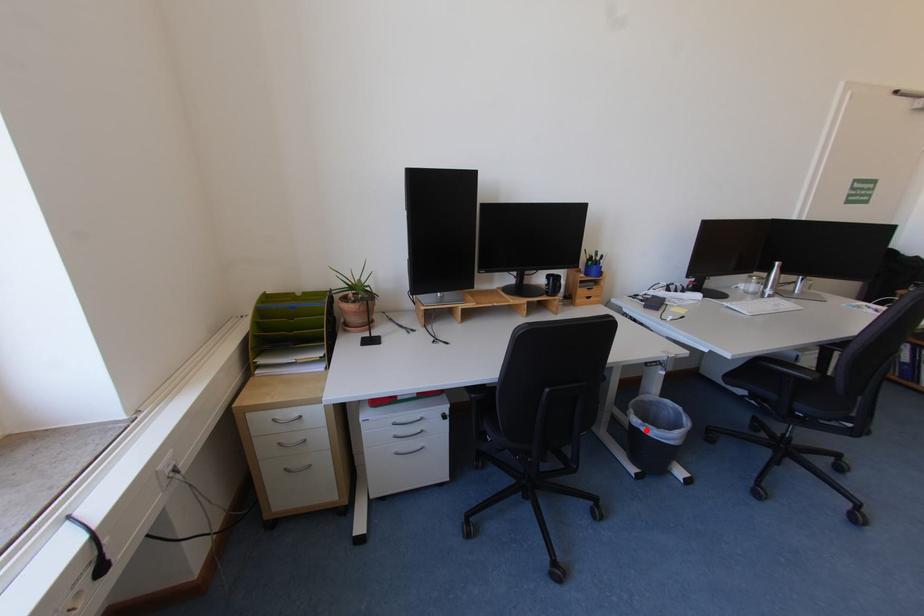
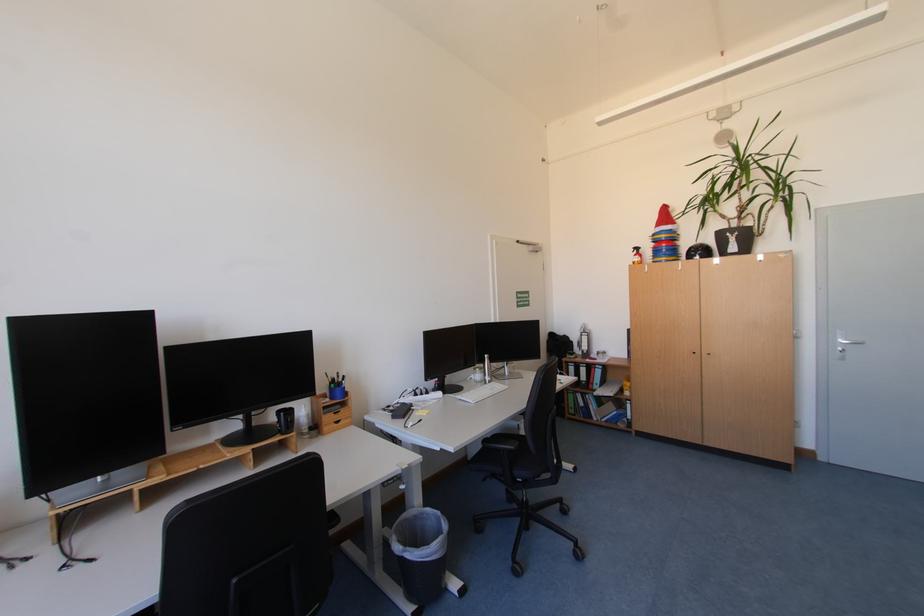
Question: I am providing you with two images of the same scene from different viewpoints. Given a red point in image1, look at the same physical point in image2. Is it:

Choices:
 (A) Closer to the viewpoint
 (B) Farther from the viewpoint

Answer: (A)